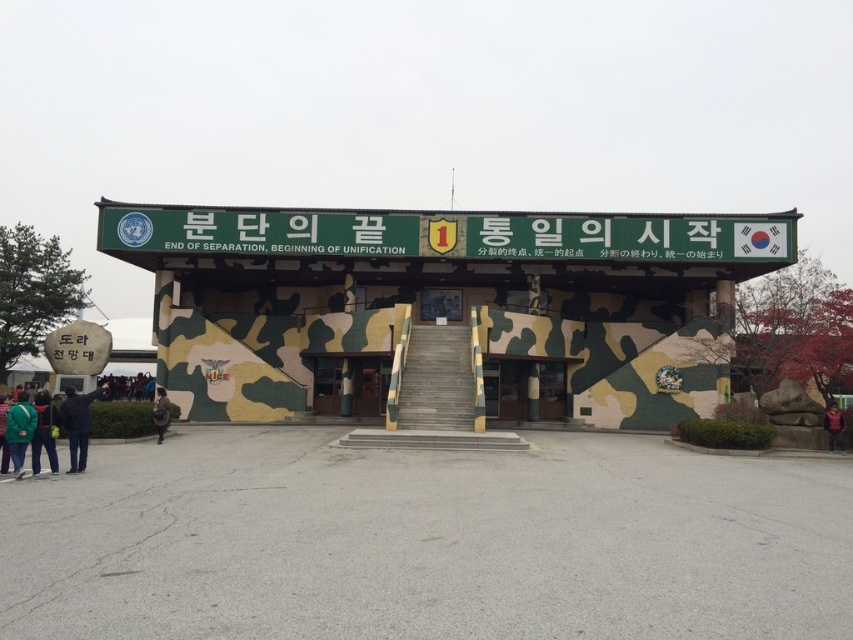
You are standing in front of the building with the camouflage door at center. If you want to enter the building, where should you walk towards based on the coordinates provided?

The camouflage door at center is located at coordinates point (350, 385), so you should walk towards that point to enter the building.

You are a security guard at the facility and need to check the entrance. You see a dark blue jacket at lower left and a camouflage jacket at lower left. Which jacket is closer to you as you approach the entrance?

The dark blue jacket at lower left is closer to you because it is in front of the camouflage jacket at lower left.

You are a visitor at the military facility and need to enter the building. You see the camouflage door at center and the camouflage jacket at lower left. Which object should you approach first to enter the building?

The camouflage door at center is located below the camouflage jacket at lower left, so you should approach the camouflage door at center first to enter the building.